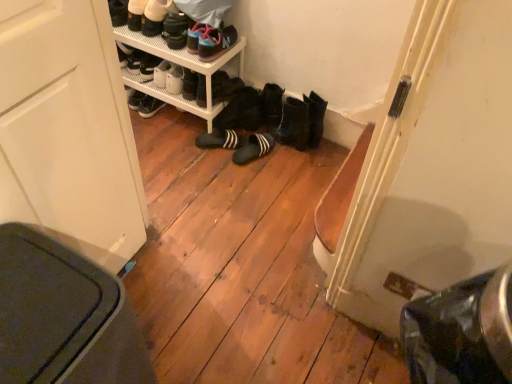
You are a GUI agent. You are given a task and a screenshot of the screen. Output one action in this format:
    pyautogui.click(x=<x>, y=<y>)
    Task: Click on the vacant point to the right of black suede slippers at center, placed as the 1th footwear when sorted from bottom to top
    This screenshot has height=384, width=512.
    Given the screenshot: What is the action you would take?
    pyautogui.click(x=281, y=155)